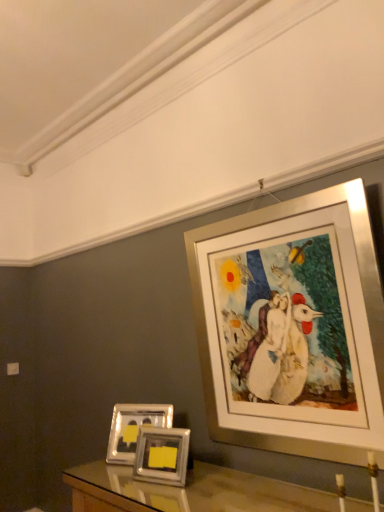
Describe the element at coordinates (162, 455) in the screenshot. I see `silver metallic photo frames at lower center, the 2th picture frame viewed from the right` at that location.

How much space does silver metallic picture frame at upper right, marked as the 3th picture frame in a left-to-right arrangement, occupy horizontally?

It is 3.46 inches.

Locate an element on the screen. silver metallic photo frames at lower center, placed as the second picture frame when sorted from left to right is located at coordinates (162, 455).

Is silver metallic photo frames at lower center, the 2th picture frame viewed from the right, far away from silver metallic picture frame at upper right, the 1th picture frame in the right-to-left sequence?

No, silver metallic photo frames at lower center, the 2th picture frame viewed from the right, is in close proximity to silver metallic picture frame at upper right, the 1th picture frame in the right-to-left sequence.

Does point (175, 450) come closer to viewer compared to point (324, 393)?

No, (175, 450) is further to viewer.

From the image's perspective, which is above, silver metallic photo frames at lower center, placed as the second picture frame when sorted from left to right, or silver metallic picture frame at upper right, the 1th picture frame in the right-to-left sequence?

silver metallic picture frame at upper right, the 1th picture frame in the right-to-left sequence.

Considering the sizes of objects silver metallic photo frames at lower center, the 2th picture frame viewed from the right, and silver metallic picture frame at upper right, marked as the 3th picture frame in a left-to-right arrangement, in the image provided, who is thinner, silver metallic photo frames at lower center, the 2th picture frame viewed from the right, or silver metallic picture frame at upper right, marked as the 3th picture frame in a left-to-right arrangement,?

Thinner between the two is silver metallic photo frames at lower center, the 2th picture frame viewed from the right.

Between metallic silver picture frame at lower left, the third picture frame positioned from the right, and silver metallic photo frames at lower center, the 2th picture frame viewed from the right, which one is positioned behind?

metallic silver picture frame at lower left, the third picture frame positioned from the right, is more distant.

Based on the photo, is metallic silver picture frame at lower left, the 1th picture frame positioned from the left, wider than silver metallic photo frames at lower center, placed as the second picture frame when sorted from left to right?

Indeed, metallic silver picture frame at lower left, the 1th picture frame positioned from the left, has a greater width compared to silver metallic photo frames at lower center, placed as the second picture frame when sorted from left to right.

Identify the location of the 1st picture frame to the right of the metallic silver picture frame at lower left, the 1th picture frame positioned from the left, starting your count from the anchor. This screenshot has height=512, width=384. (162, 455).

Between point (173, 413) and point (148, 445), which one is positioned behind?

The point (173, 413) is behind.

Is silver metallic picture frame at upper right, the 1th picture frame in the right-to-left sequence, facing away from silver metallic photo frames at lower center, the 2th picture frame viewed from the right?

No, silver metallic photo frames at lower center, the 2th picture frame viewed from the right, is not at the back of silver metallic picture frame at upper right, the 1th picture frame in the right-to-left sequence.

In order to click on the 1st picture frame to the left of the silver metallic picture frame at upper right, marked as the 3th picture frame in a left-to-right arrangement, starting your count from the anchor in this screenshot , I will do `click(162, 455)`.

Considering the points (363, 238) and (150, 446), which point is in front, point (363, 238) or point (150, 446)?

The point (363, 238) is in front.

Looking at this image, measure the distance between metallic silver picture frame at lower left, the third picture frame positioned from the right, and silver metallic picture frame at upper right, marked as the 3th picture frame in a left-to-right arrangement.

They are 81.40 centimeters apart.

Is metallic silver picture frame at lower left, the 1th picture frame positioned from the left, positioned before silver metallic picture frame at upper right, marked as the 3th picture frame in a left-to-right arrangement?

No, metallic silver picture frame at lower left, the 1th picture frame positioned from the left, is further to the viewer.

Is metallic silver picture frame at lower left, the third picture frame positioned from the right, not inside silver metallic picture frame at upper right, marked as the 3th picture frame in a left-to-right arrangement?

Indeed, metallic silver picture frame at lower left, the third picture frame positioned from the right, is completely outside silver metallic picture frame at upper right, marked as the 3th picture frame in a left-to-right arrangement.

Does point (110, 442) come farther from viewer compared to point (261, 342)?

Yes, it is behind point (261, 342).

Is silver metallic photo frames at lower center, placed as the second picture frame when sorted from left to right, oriented away from metallic silver picture frame at lower left, the third picture frame positioned from the right?

silver metallic photo frames at lower center, placed as the second picture frame when sorted from left to right, is not turned away from metallic silver picture frame at lower left, the third picture frame positioned from the right.

Which object is more forward, silver metallic photo frames at lower center, placed as the second picture frame when sorted from left to right, or metallic silver picture frame at lower left, the 1th picture frame positioned from the left?

silver metallic photo frames at lower center, placed as the second picture frame when sorted from left to right, is closer to the camera.

What's the angular difference between silver metallic photo frames at lower center, the 2th picture frame viewed from the right, and metallic silver picture frame at lower left, the third picture frame positioned from the right,'s facing directions?

9.28 degrees.

Which object is thinner, silver metallic photo frames at lower center, placed as the second picture frame when sorted from left to right, or metallic silver picture frame at lower left, the 1th picture frame positioned from the left?

With smaller width is silver metallic photo frames at lower center, placed as the second picture frame when sorted from left to right.

From a real-world perspective, between silver metallic picture frame at upper right, marked as the 3th picture frame in a left-to-right arrangement, and metallic silver picture frame at lower left, the third picture frame positioned from the right, who is vertically higher?

silver metallic picture frame at upper right, marked as the 3th picture frame in a left-to-right arrangement, from a real-world perspective.

Considering the points (224, 383) and (133, 437), which point is behind, point (224, 383) or point (133, 437)?

The point (133, 437) is more distant.

Is metallic silver picture frame at lower left, the 1th picture frame positioned from the left, completely or partially inside silver metallic picture frame at upper right, the 1th picture frame in the right-to-left sequence?

No, metallic silver picture frame at lower left, the 1th picture frame positioned from the left, is not a part of silver metallic picture frame at upper right, the 1th picture frame in the right-to-left sequence.

From the image's perspective, starting from the silver metallic picture frame at upper right, marked as the 3th picture frame in a left-to-right arrangement, which picture frame is the 1st one below? Please provide its 2D coordinates.

[(162, 455)]

Image resolution: width=384 pixels, height=512 pixels. Find the location of `picture frame on the left of silver metallic photo frames at lower center, placed as the second picture frame when sorted from left to right`. picture frame on the left of silver metallic photo frames at lower center, placed as the second picture frame when sorted from left to right is located at coordinates (133, 428).

Looking at the image, which one is located further to silver metallic photo frames at lower center, placed as the second picture frame when sorted from left to right, silver metallic picture frame at upper right, marked as the 3th picture frame in a left-to-right arrangement, or metallic silver picture frame at lower left, the 1th picture frame positioned from the left?

Among the two, silver metallic picture frame at upper right, marked as the 3th picture frame in a left-to-right arrangement, is located further to silver metallic photo frames at lower center, placed as the second picture frame when sorted from left to right.

Looking at the image, which one is located further to silver metallic picture frame at upper right, marked as the 3th picture frame in a left-to-right arrangement, silver metallic photo frames at lower center, the 2th picture frame viewed from the right, or metallic silver picture frame at lower left, the third picture frame positioned from the right?

metallic silver picture frame at lower left, the third picture frame positioned from the right, lies further to silver metallic picture frame at upper right, marked as the 3th picture frame in a left-to-right arrangement, than the other object.

Considering their positions, is silver metallic picture frame at upper right, marked as the 3th picture frame in a left-to-right arrangement, positioned closer to metallic silver picture frame at lower left, the 1th picture frame positioned from the left, than silver metallic photo frames at lower center, the 2th picture frame viewed from the right?

Among the two, silver metallic photo frames at lower center, the 2th picture frame viewed from the right, is located nearer to metallic silver picture frame at lower left, the 1th picture frame positioned from the left.

Which object lies nearer to the anchor point metallic silver picture frame at lower left, the 1th picture frame positioned from the left, silver metallic photo frames at lower center, placed as the second picture frame when sorted from left to right, or silver metallic picture frame at upper right, marked as the 3th picture frame in a left-to-right arrangement?

silver metallic photo frames at lower center, placed as the second picture frame when sorted from left to right, is positioned closer to the anchor metallic silver picture frame at lower left, the 1th picture frame positioned from the left.

When comparing their distances from silver metallic photo frames at lower center, the 2th picture frame viewed from the right, does metallic silver picture frame at lower left, the third picture frame positioned from the right, or silver metallic picture frame at upper right, marked as the 3th picture frame in a left-to-right arrangement, seem closer?

Based on the image, metallic silver picture frame at lower left, the third picture frame positioned from the right, appears to be nearer to silver metallic photo frames at lower center, the 2th picture frame viewed from the right.

Which object lies further to the anchor point silver metallic picture frame at upper right, the 1th picture frame in the right-to-left sequence, metallic silver picture frame at lower left, the 1th picture frame positioned from the left, or silver metallic photo frames at lower center, placed as the second picture frame when sorted from left to right?

Among the two, metallic silver picture frame at lower left, the 1th picture frame positioned from the left, is located further to silver metallic picture frame at upper right, the 1th picture frame in the right-to-left sequence.

Identify the location of picture frame that lies between silver metallic picture frame at upper right, marked as the 3th picture frame in a left-to-right arrangement, and metallic silver picture frame at lower left, the third picture frame positioned from the right, from top to bottom. Image resolution: width=384 pixels, height=512 pixels. (162, 455).